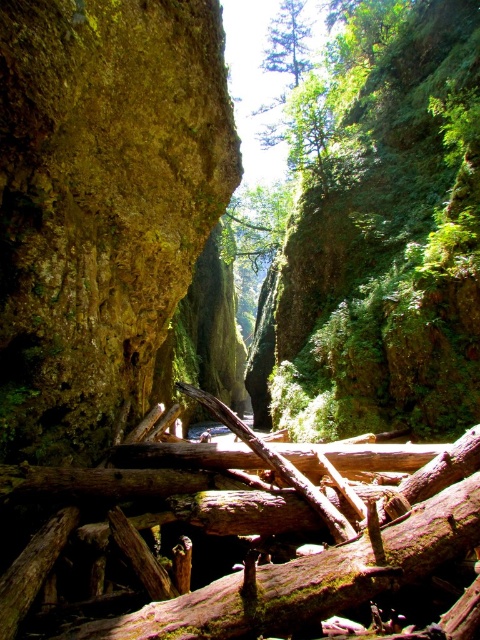
You are standing at the entrance of the canyon and want to reach a specific location. You see two points marked in the image. Which point is closer to you, point (x=26, y=346) or point (x=300, y=77)?

Point (x=26, y=346) is in front of point (x=300, y=77), so it is closer to you.

You are standing at the point with coordinates point (231, 420) and want to walk towards the point with coordinates point (60, 138). Will you be moving towards the foreground or background of the scene?

Since point (60, 138) is behind point (231, 420), you will be moving towards the background of the scene.

You are an explorer in the canyon and need to determine which object is taller between the rusty metallic rock at left and the green matte tree at upper center. Based on the scene, which one is taller?

The green matte tree at upper center is taller than the rusty metallic rock at left.